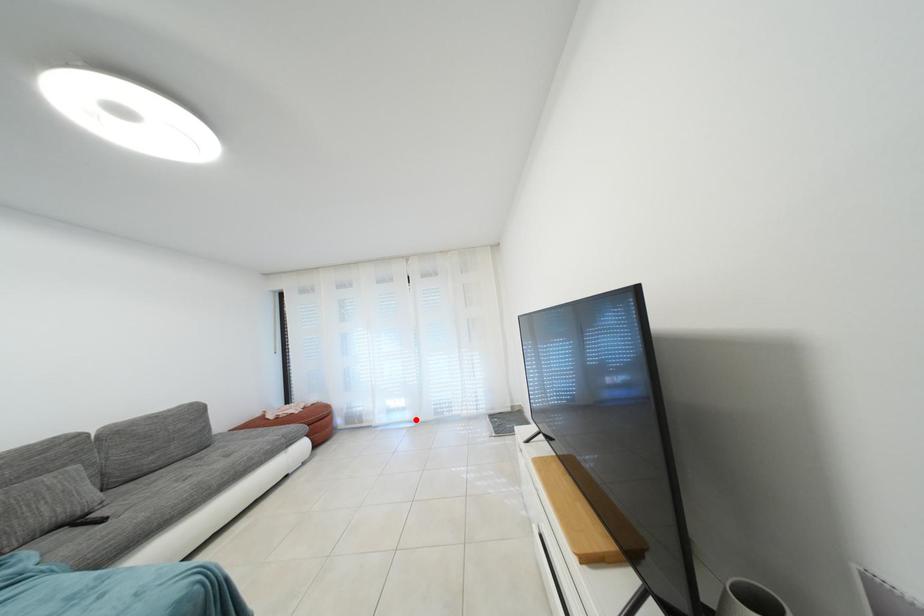
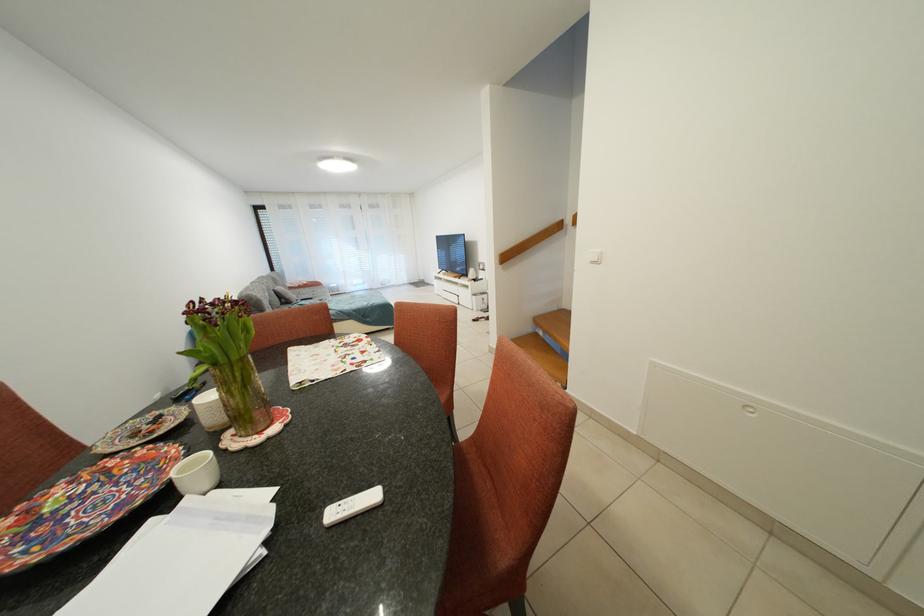
Where in the second image is the point corresponding to the highlighted location from the first image?

(373, 291)